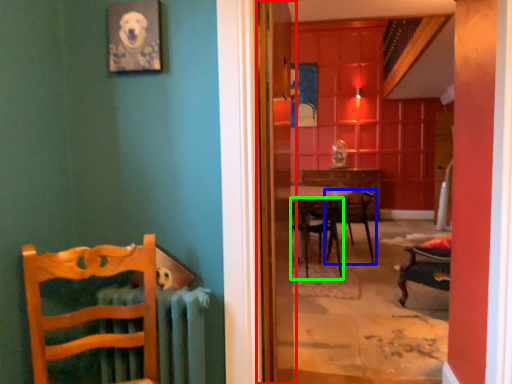
Question: Based on their relative distances, which object is farther from screen door (highlighted by a red box)? Choose from chair (highlighted by a blue box) and chair (highlighted by a green box).

Choices:
 (A) chair
 (B) chair

Answer: (A)